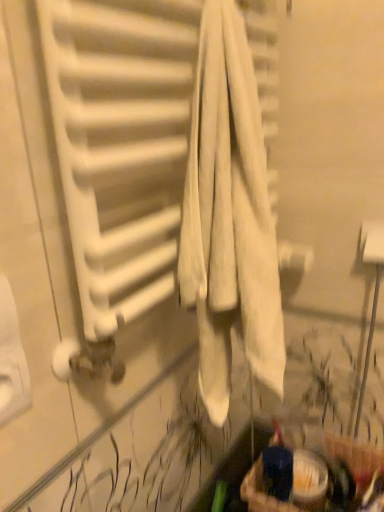
Question: From their relative heights in the image, would you say matte brown basket at lower right is taller or shorter than white matte radiator at center?

Choices:
 (A) short
 (B) tall

Answer: (A)

Question: From a real-world perspective, is matte brown basket at lower right positioned above or below white matte radiator at center?

Choices:
 (A) below
 (B) above

Answer: (A)

Question: In terms of width, does matte brown basket at lower right look wider or thinner when compared to white matte radiator at center?

Choices:
 (A) wide
 (B) thin

Answer: (B)

Question: Choose the correct answer: Is white matte radiator at center inside matte brown basket at lower right or outside it?

Choices:
 (A) inside
 (B) outside

Answer: (B)

Question: From the image's perspective, is white matte radiator at center above or below matte brown basket at lower right?

Choices:
 (A) above
 (B) below

Answer: (A)

Question: Is point (74, 38) closer or farther from the camera than point (291, 480)?

Choices:
 (A) farther
 (B) closer

Answer: (B)

Question: In terms of width, does white matte radiator at center look wider or thinner when compared to matte brown basket at lower right?

Choices:
 (A) wide
 (B) thin

Answer: (A)